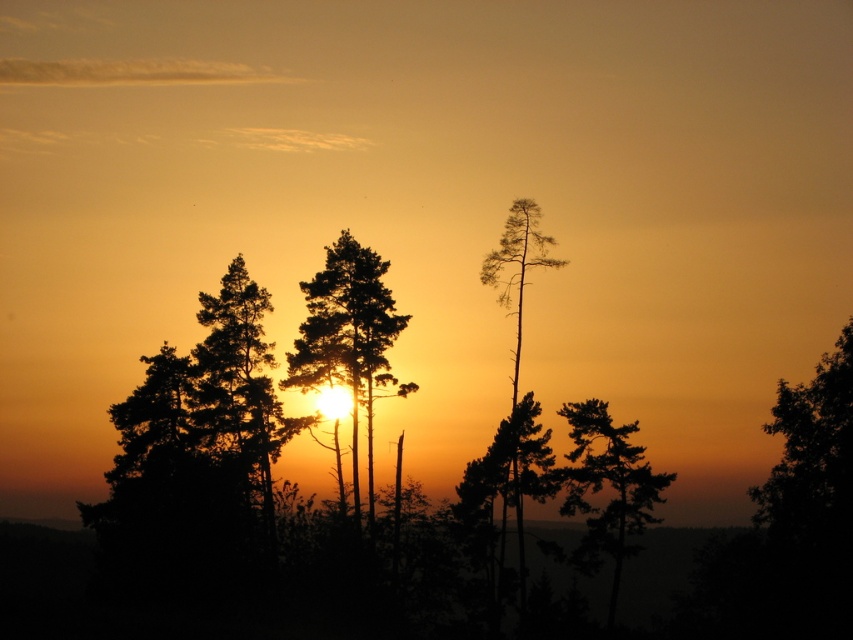
You are observing the sunset scene and want to take a photo focusing on the two points in the image. Which point, point (786, 428) or point (509, 268), is closer to your camera lens?

Point (786, 428) is closer to the camera than point (509, 268).

You are standing in the sunset scene and want to take a photo of the dark green leafy tree at right. The camera you are using has a fixed focus point at position point (811, 456). Will this focus point be on the dark green leafy tree at right?

Yes, the point (811, 456) corresponds to the dark green leafy tree at right, so the focus point will be on it.

You are an artist sketching the sunset scene. You want to draw the dark green leafy tree at right and the silhouette tree at center. Which tree should you sketch first to ensure proper layering based on their positions?

You should sketch the dark green leafy tree at right first because it is closer to the viewer than the silhouette tree at center, so it should be layered in front.